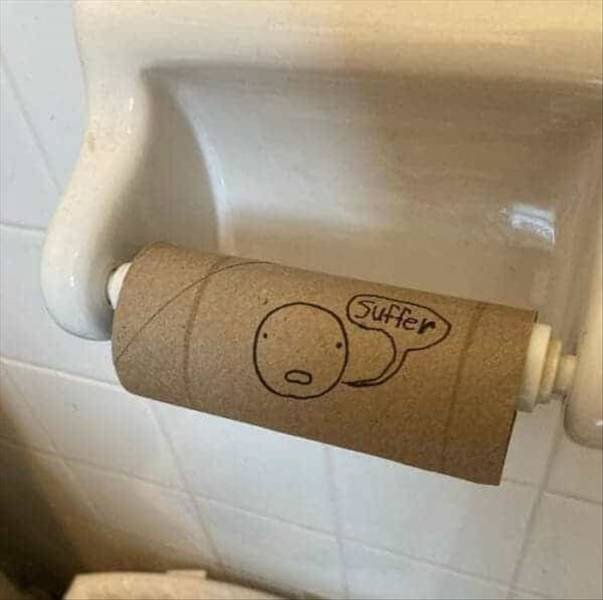
Where is `toilet paler roll`? The height and width of the screenshot is (600, 603). toilet paler roll is located at coordinates (189, 342).